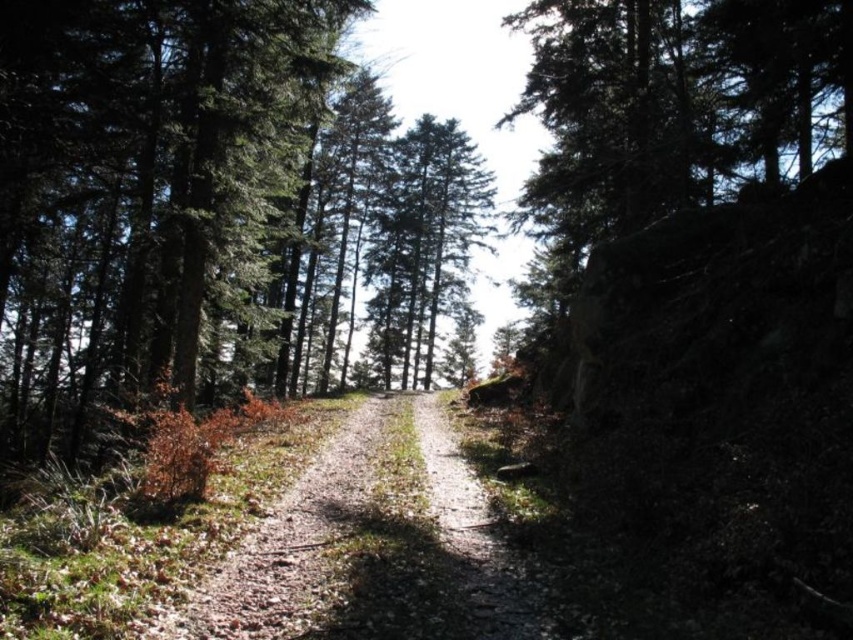
You are a hiker trying to follow the path through the forest. You see the green textured tree at center and the dusty gravel path at center. Which object is located to the right of the other?

The green textured tree at center is positioned on the left side of dusty gravel path at center, so the dusty gravel path at center is to the right of the green textured tree at center.

You are a hiker carrying a backpack and want to walk along the path shown in the image. The path is narrow and bordered by a large tree. Based on the scene, can you determine if the green textured tree at center is too big to block your way on the dusty gravel path at center?

The green textured tree at center is larger in size than the dusty gravel path at center, but since the path is described as narrow and well trodden, it is likely that the tree does not block the path entirely. The tree may be positioned to the side, allowing passage along the path.

You are a hiker who wants to take a photo of the green textured tree at center and the dusty gravel path at center. Since you want the tree to be the main focus, which object should you position closer to the camera lens?

The green textured tree at center should be positioned closer to the camera lens because it is above the dusty gravel path at center, making it naturally closer to the camera when aligned along the path.